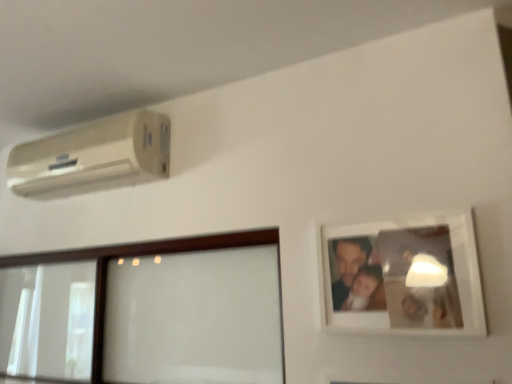
What do you see at coordinates (93, 154) in the screenshot? I see `white textured air conditioner at upper left` at bounding box center [93, 154].

This screenshot has height=384, width=512. I want to click on white textured air conditioner at upper left, so click(x=93, y=154).

Describe the element at coordinates (405, 276) in the screenshot. I see `white matte picture frame at upper right` at that location.

Find the location of a particular element. This screenshot has width=512, height=384. white matte picture frame at upper right is located at coordinates (405, 276).

At what (x,y) coordinates should I click in order to perform the action: click on white textured air conditioner at upper left. Please return your answer as a coordinate pair (x, y). This screenshot has height=384, width=512. Looking at the image, I should click on (93, 154).

Is white matte picture frame at upper right at the right side of white textured air conditioner at upper left?

Indeed, white matte picture frame at upper right is positioned on the right side of white textured air conditioner at upper left.

Which is behind, white matte picture frame at upper right or white textured air conditioner at upper left?

Positioned behind is white textured air conditioner at upper left.

Which is in front, point (388, 239) or point (77, 152)?

The point (388, 239) is in front.

From the image's perspective, between white matte picture frame at upper right and white textured air conditioner at upper left, which one is located above?

From the image's view, white textured air conditioner at upper left is above.

From a real-world perspective, which object stands above the other?

From a 3D spatial view, white textured air conditioner at upper left is above.

Considering the sizes of objects white matte picture frame at upper right and white textured air conditioner at upper left in the image provided, who is thinner, white matte picture frame at upper right or white textured air conditioner at upper left?

Thinner between the two is white matte picture frame at upper right.

Considering the relative sizes of white matte picture frame at upper right and white textured air conditioner at upper left in the image provided, is white matte picture frame at upper right taller than white textured air conditioner at upper left?

Indeed, white matte picture frame at upper right has a greater height compared to white textured air conditioner at upper left.

From the picture: Considering the sizes of objects white matte picture frame at upper right and white textured air conditioner at upper left in the image provided, who is bigger, white matte picture frame at upper right or white textured air conditioner at upper left?

white textured air conditioner at upper left.

Is white matte picture frame at upper right inside the boundaries of white textured air conditioner at upper left, or outside?

white matte picture frame at upper right exists outside the volume of white textured air conditioner at upper left.

Is white matte picture frame at upper right far from white textured air conditioner at upper left?

No, white matte picture frame at upper right is not far from white textured air conditioner at upper left.

Is white matte picture frame at upper right aimed at white textured air conditioner at upper left?

No, white matte picture frame at upper right does not turn towards white textured air conditioner at upper left.

What are the coordinates of `picture frame on the right of white textured air conditioner at upper left` in the screenshot? It's located at (405, 276).

Is white textured air conditioner at upper left to the right of white matte picture frame at upper right from the viewer's perspective?

No, white textured air conditioner at upper left is not to the right of white matte picture frame at upper right.

Which is in front, white textured air conditioner at upper left or white matte picture frame at upper right?

white matte picture frame at upper right.

Which is closer to the camera, (x=156, y=119) or (x=440, y=238)?

The point (x=440, y=238) is in front.

From the image's perspective, which one is positioned lower, white textured air conditioner at upper left or white matte picture frame at upper right?

From the image's view, white matte picture frame at upper right is below.

From a real-world perspective, does white textured air conditioner at upper left sit lower than white matte picture frame at upper right?

No, from a real-world perspective, white textured air conditioner at upper left is not under white matte picture frame at upper right.

Considering the sizes of objects white textured air conditioner at upper left and white matte picture frame at upper right in the image provided, who is wider, white textured air conditioner at upper left or white matte picture frame at upper right?

Wider between the two is white textured air conditioner at upper left.

Considering the sizes of white textured air conditioner at upper left and white matte picture frame at upper right in the image, is white textured air conditioner at upper left taller or shorter than white matte picture frame at upper right?

Clearly, white textured air conditioner at upper left is shorter compared to white matte picture frame at upper right.

Does white textured air conditioner at upper left have a smaller size compared to white matte picture frame at upper right?

Incorrect, white textured air conditioner at upper left is not smaller in size than white matte picture frame at upper right.

Is white matte picture frame at upper right located within white textured air conditioner at upper left?

No, white matte picture frame at upper right is not surrounded by white textured air conditioner at upper left.

Is white textured air conditioner at upper left positioned far away from white matte picture frame at upper right?

No, there isn't a large distance between white textured air conditioner at upper left and white matte picture frame at upper right.

Is white textured air conditioner at upper left oriented towards white matte picture frame at upper right?

No, white textured air conditioner at upper left is not facing towards white matte picture frame at upper right.

How many degrees apart are the facing directions of white textured air conditioner at upper left and white matte picture frame at upper right?

0.847 degrees.

This screenshot has width=512, height=384. I want to click on picture frame on the right side of white textured air conditioner at upper left, so [405, 276].

Locate an element on the screen. The height and width of the screenshot is (384, 512). air conditioning above the white matte picture frame at upper right (from a real-world perspective) is located at coordinates (93, 154).

Identify the location of picture frame lying on the right of white textured air conditioner at upper left. (405, 276).